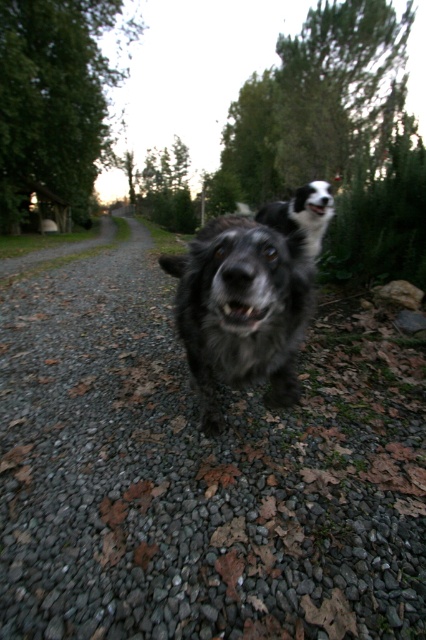
You are a hiker who wants to place a small backpack on the ground between the fuzzy black dog at center and the gray rock at center. Is there enough space between them for the backpack?

The fuzzy black dog at center is below the gray rock at center, so there is vertical space between them. However, since the question asks about placing a backpack between them horizontally, the description does not provide information about horizontal distance. Therefore, it is unclear if there is enough space horizontally for the backpack.

You are standing on the gravel path and see the fuzzy black dog at center and the green leafy tree at upper left. Which object is positioned to the left of the other?

The green leafy tree at upper left is to the left of the fuzzy black dog at center.